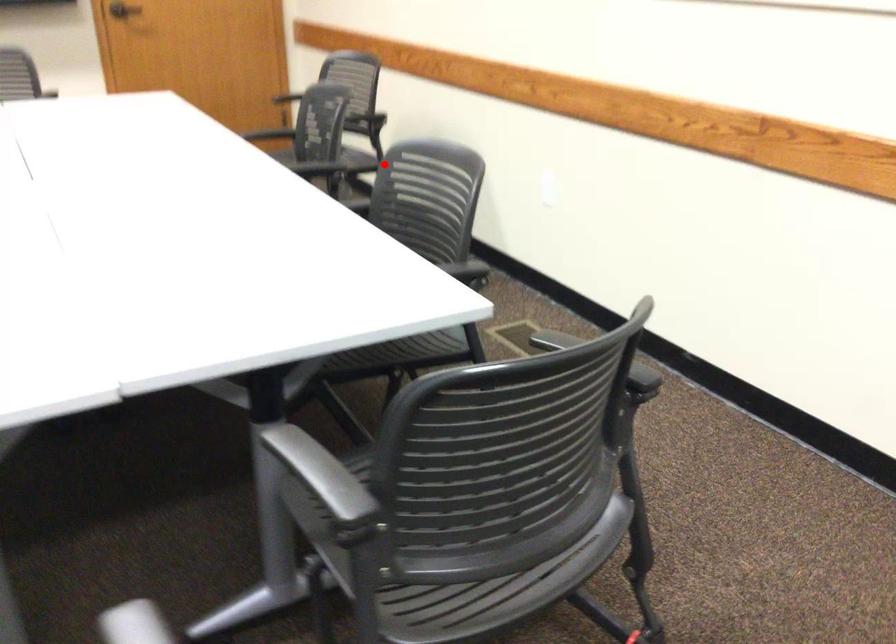
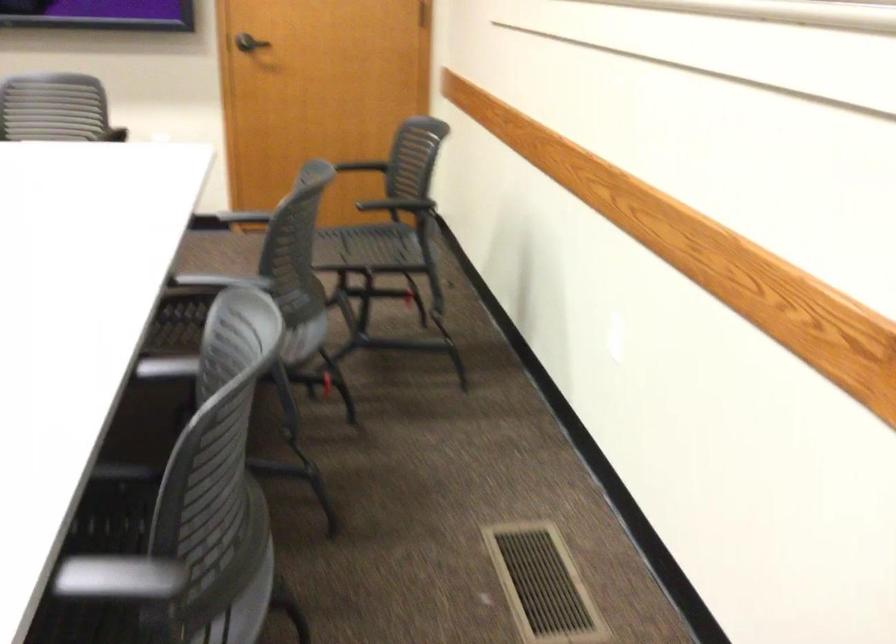
Question: I am providing you with two images of the same scene from different viewpoints. Given a red point in image1, look at the same physical point in image2. Is it:

Choices:
 (A) Closer to the viewpoint
 (B) Farther from the viewpoint

Answer: (A)